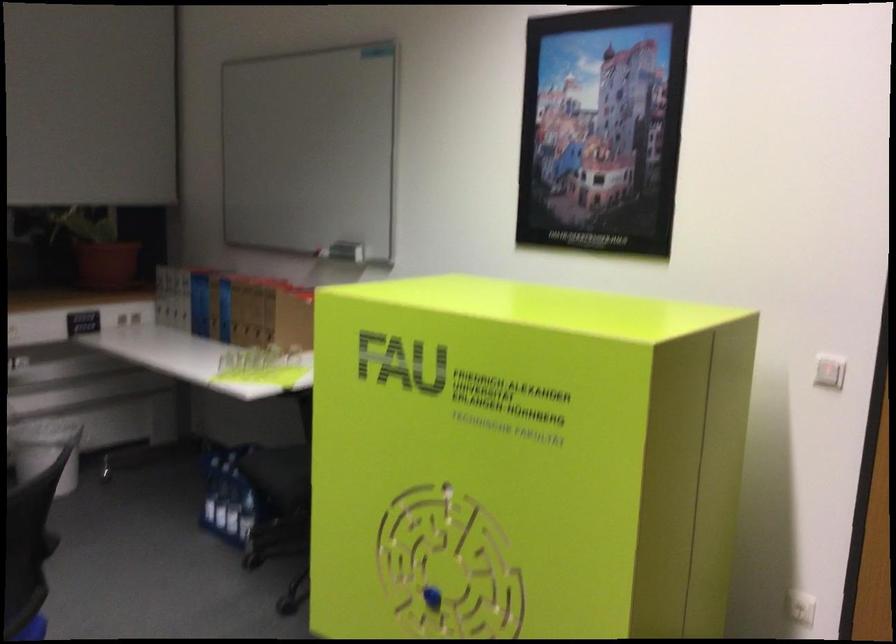
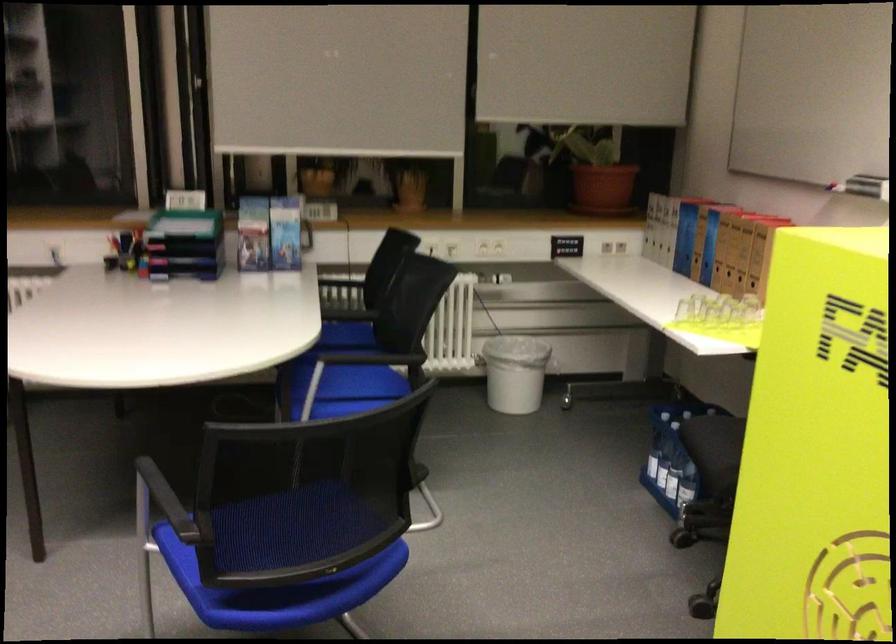
Find the pixel in the second image that matches point 211,502 in the first image.

(650, 458)